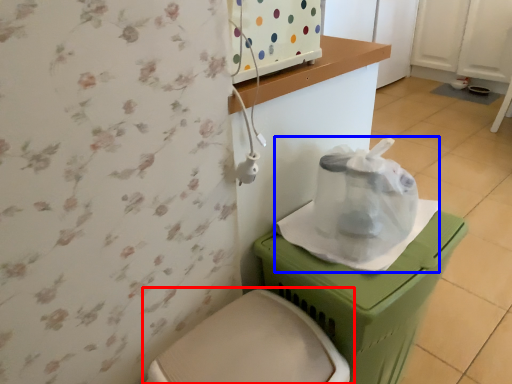
Question: Which object is further to the camera taking this photo, toilet (highlighted by a red box) or paper bag (highlighted by a blue box)?

Choices:
 (A) toilet
 (B) paper bag

Answer: (B)